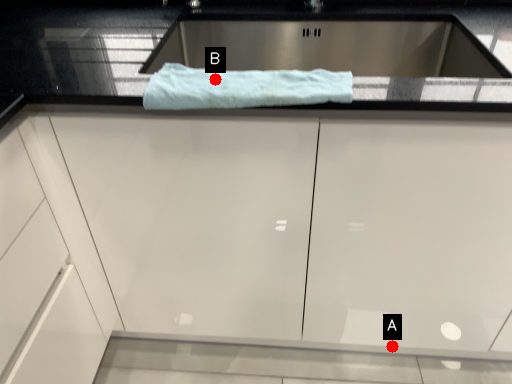
Question: Two points are circled on the image, labeled by A and B beside each circle. Which of the following is the farthest from the observer?

Choices:
 (A) A is further
 (B) B is further

Answer: (A)